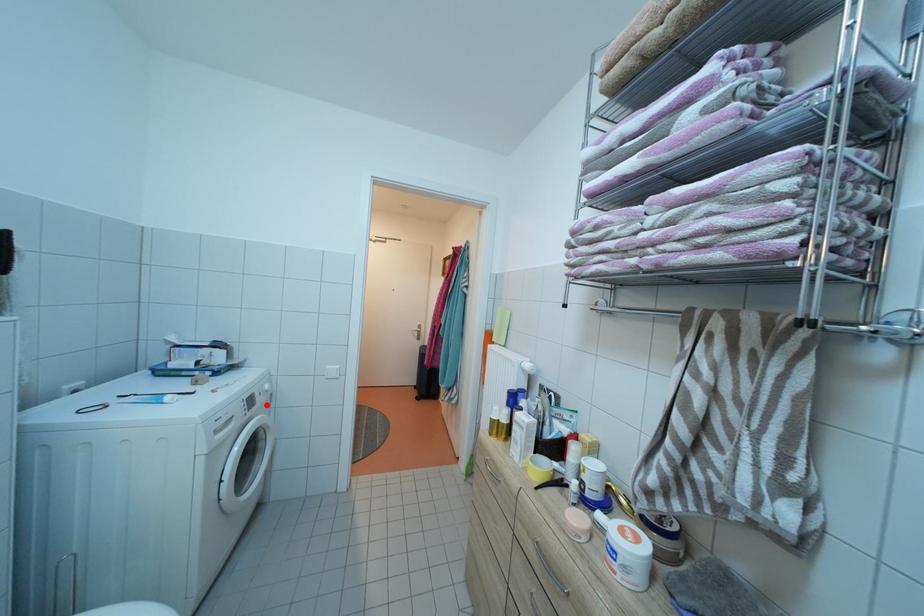
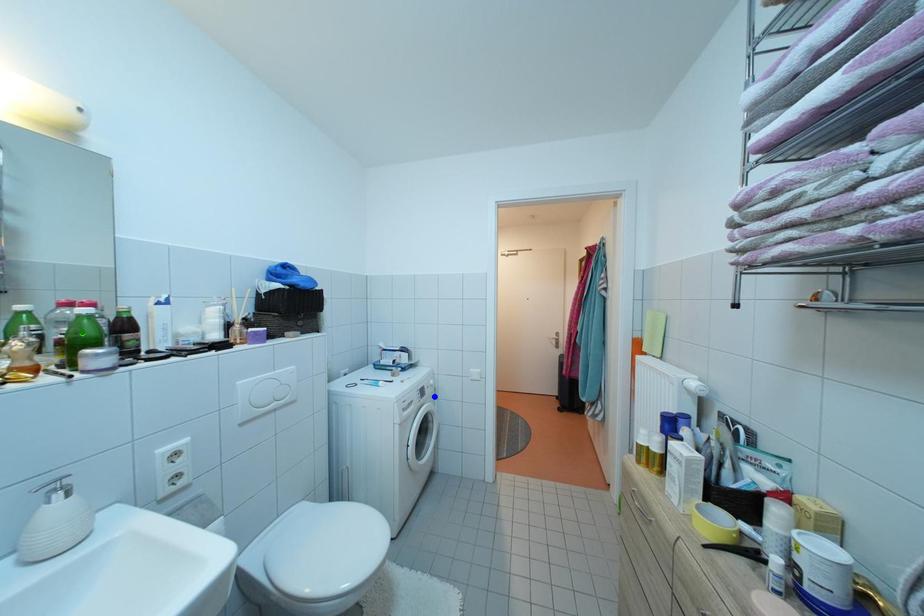
Question: I am providing you with two images of the same scene from different viewpoints. A red point is marked on the first image. You are given multiple points on the second image. Which mark in image 2 goes with the point in image 1?

Choices:
 (A) blue point
 (B) yellow point
 (C) green point

Answer: (A)